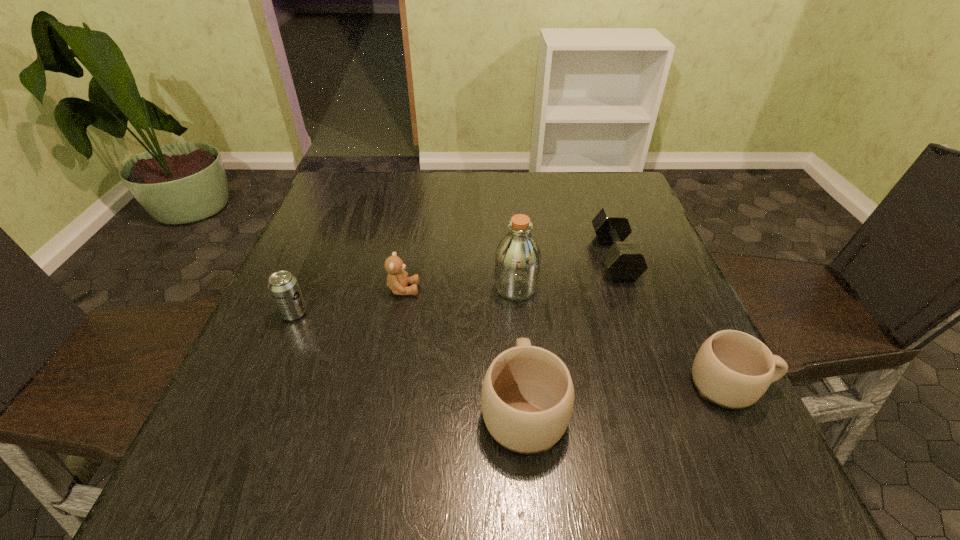
Where is `vacant place for an extra mug on the left`? This screenshot has height=540, width=960. vacant place for an extra mug on the left is located at coordinates (297, 432).